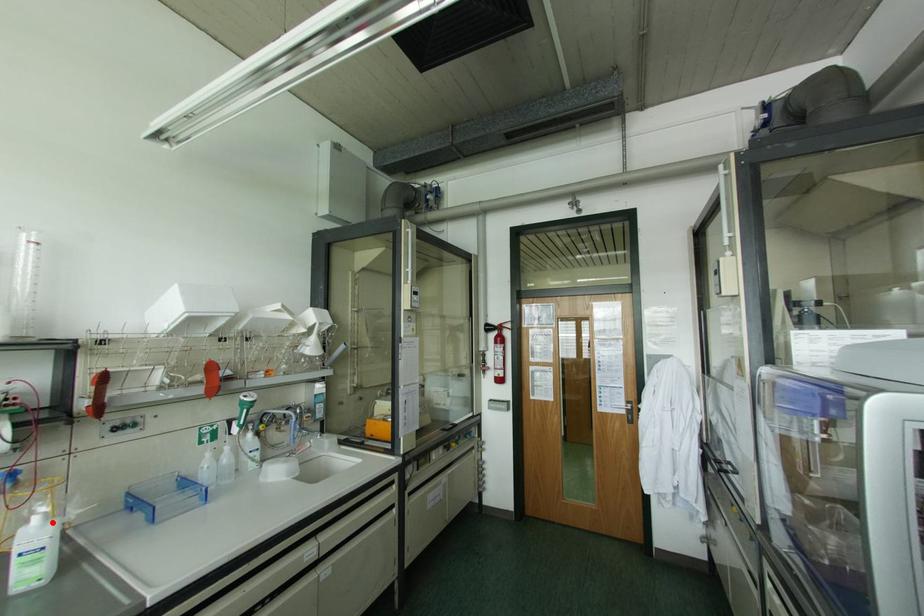
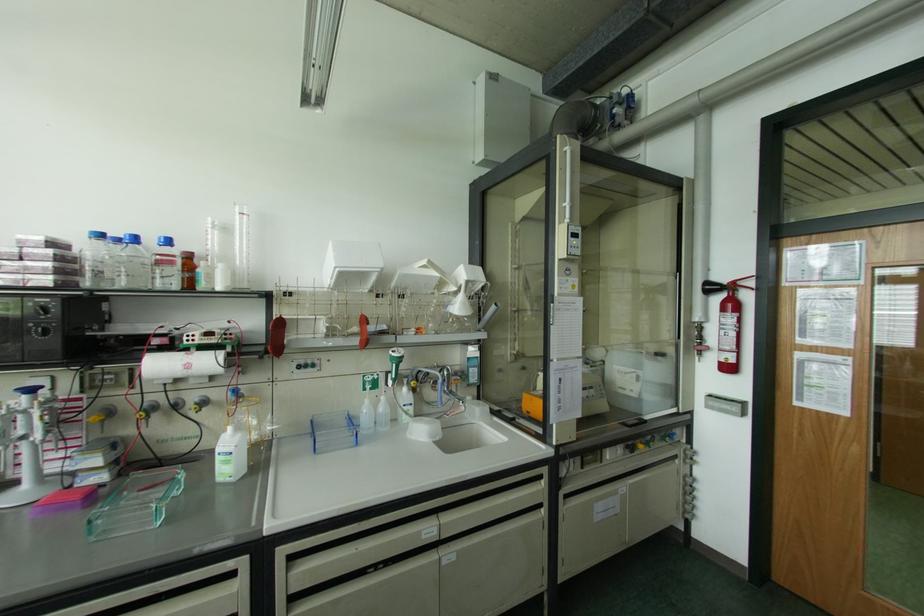
Question: A red point is marked in image1. In image2, is the corresponding 3D point closer to the camera or farther? Reply with the corresponding letter.

Choices:
 (A) The corresponding 3D point is closer.
 (B) The corresponding 3D point is farther.

Answer: (B)